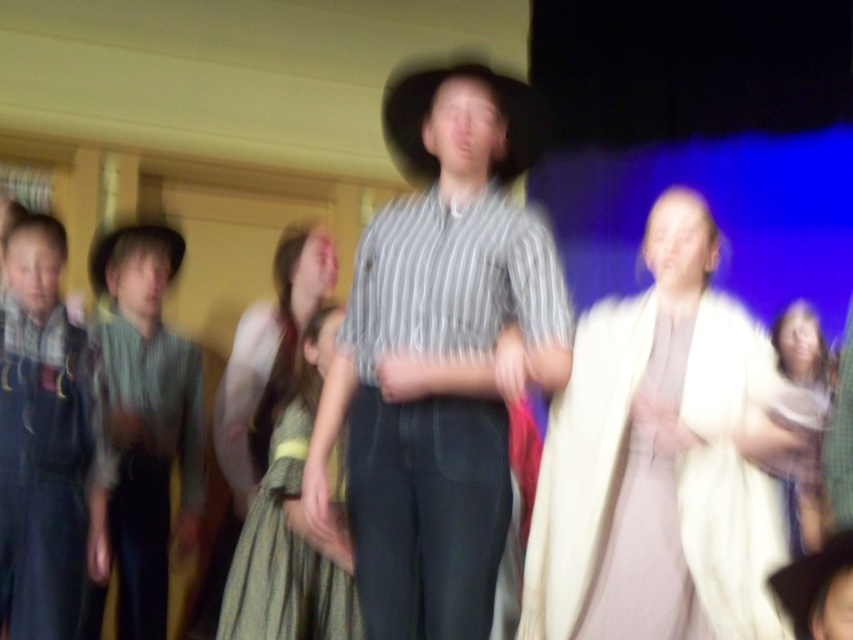
Can you confirm if striped fabric shirt at left is positioned above brown felt cowboy hat at center?

Actually, striped fabric shirt at left is below brown felt cowboy hat at center.

Who is positioned more to the right, striped fabric shirt at left or brown felt cowboy hat at center?

From the viewer's perspective, brown felt cowboy hat at center appears more on the right side.

I want to click on striped fabric shirt at left, so click(148, 417).

Can you confirm if striped cotton shirt at center is smaller than brown felt cowboy hat at center?

Actually, striped cotton shirt at center might be larger than brown felt cowboy hat at center.

Image resolution: width=853 pixels, height=640 pixels. What are the coordinates of `striped cotton shirt at center` in the screenshot? It's located at (439, 355).

Does point (73, 499) lie in front of point (512, 148)?

No.

Does dark green fabric robe at left appear on the right side of brown felt cowboy hat at center?

In fact, dark green fabric robe at left is to the left of brown felt cowboy hat at center.

Between point (3, 458) and point (421, 104), which one is positioned behind?

The point (3, 458) is more distant.

Where is `dark green fabric robe at left`? The image size is (853, 640). dark green fabric robe at left is located at coordinates coord(45,472).